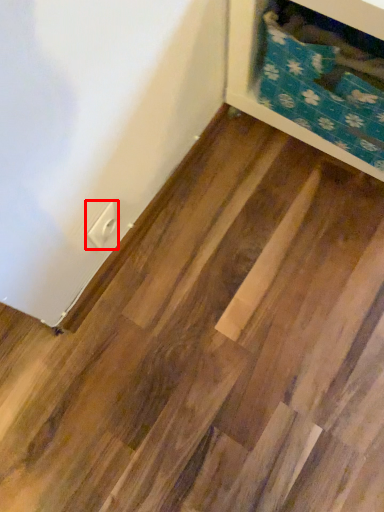
Question: From the image's perspective, where is electric outlet (annotated by the red box) located relative to furniture?

Choices:
 (A) above
 (B) below

Answer: (B)